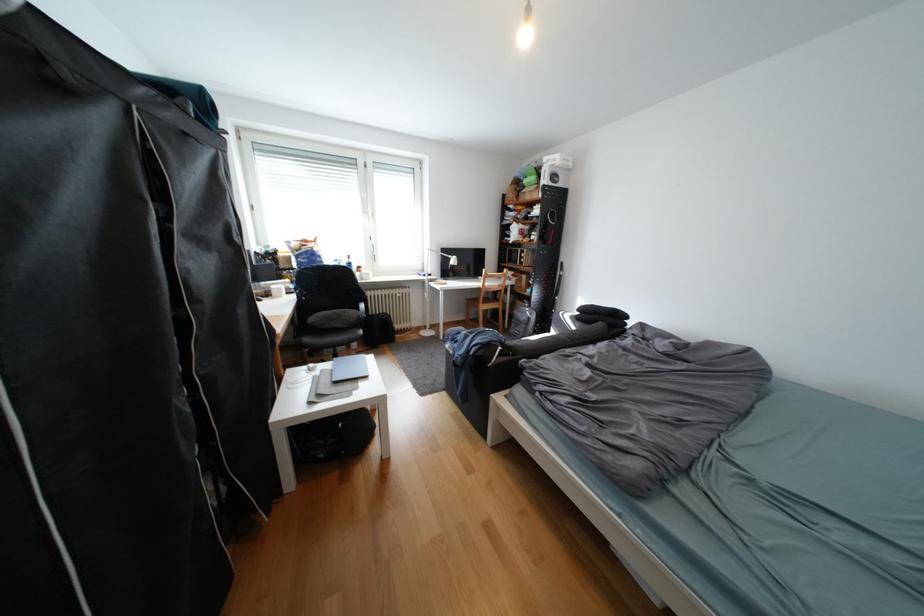
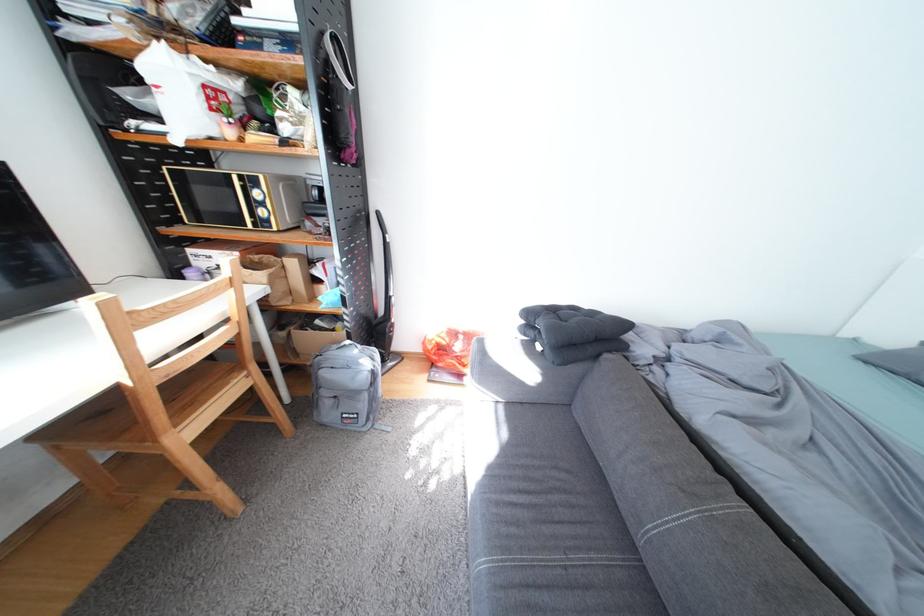
The point at [529,283] is marked in the first image. Where is the corresponding point in the second image?

(285, 284)